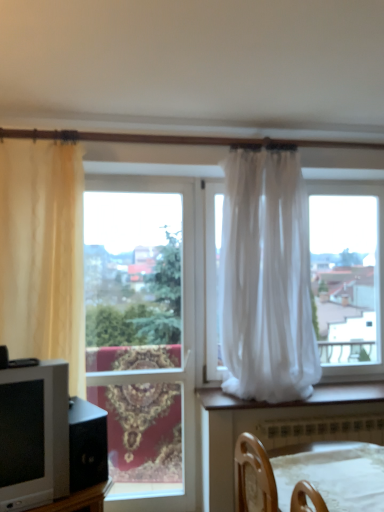
Identify the location of empty space that is ontop of clear glass window at center (from a real-world perspective). (141, 178).